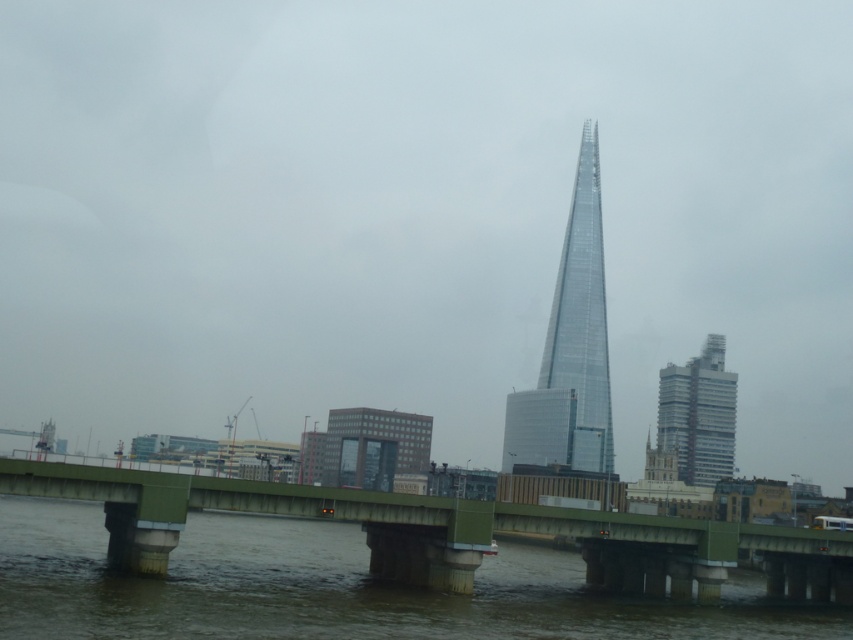
You are a city planner analyzing the cityscape. You need to determine which structure has a narrower width between the green concrete bridge at center and the transparent glass tower at center. Which one is narrower?

The green concrete bridge at center is thinner than the transparent glass tower at center, so the green concrete bridge at center is narrower in width.

You are standing on the bridge and want to take a photo of the transparent glass tower at center. The camera you have can focus on objects up to 1000 feet away. Will the tower be in focus?

The transparent glass tower at center is 1022.71 feet away from viewer, which is beyond the camera focus limit of 1000 feet. The tower will not be in focus.